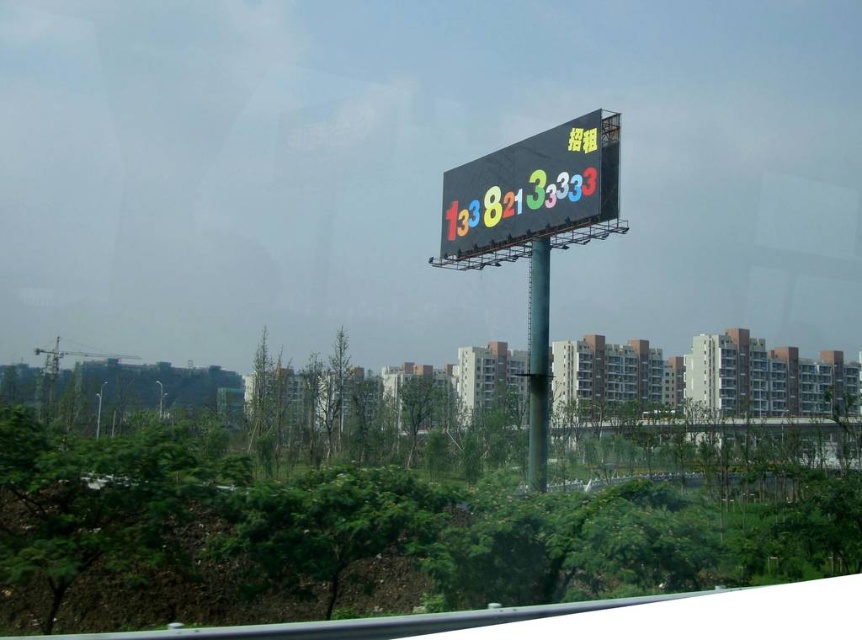
You are a delivery person trying to navigate through the area. You see the multicolored digital display at center and the green metallic pole at center. Which one is closer to you?

The multicolored digital display at center is closer to you because it is further to the viewer than the green metallic pole at center, meaning it appears in front of the pole.

From the picture: You are standing in front of the large digital billboard and want to locate the point with coordinates (533, 193). Based on the scene description, where exactly would this point be located?

The point with coordinates (533, 193) is located on the multicolored digital display at center, which shows the number sequence 1338213333 in bright colors.

You are a delivery person who needs to park your 2.5 meter wide truck near the green metallic pole at center. The parking space available is directly in front of the multicolored digital display at center. Considering the size of the pole and display, will your truck fit in the parking space without blocking the display?

The multicolored digital display at center is bigger than the green metallic pole at center. However, since the parking space is in front of the display, the truck should be parked there. As the display is larger, it might occupy more space, but the truck width of 2.5 meters should fit if the parking area is appropriately sized. However, without specific dimensions of the parking space, it is hard to confirm. But since the pole is smaller than the display, and the truck is parked in front of the display, it